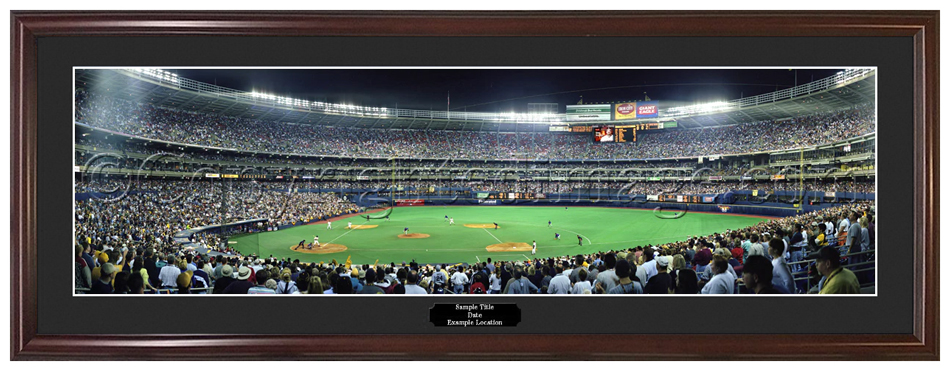
Identify the location of black rectangular metallic plaque. (435, 308).